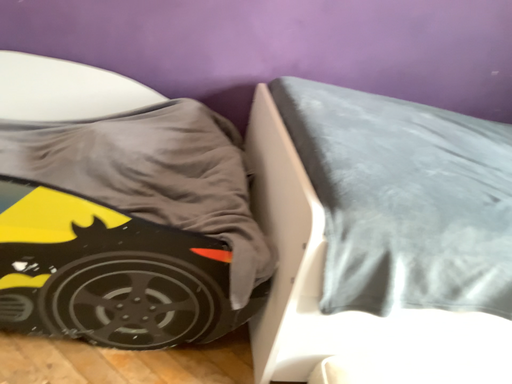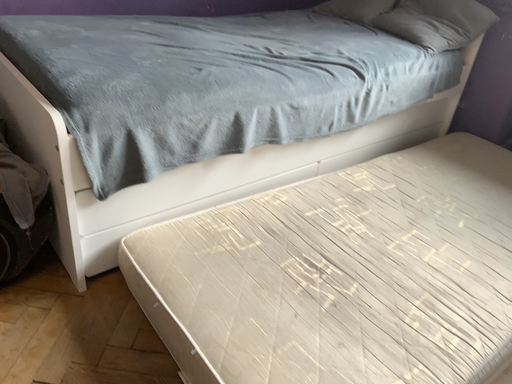
Question: How did the camera likely rotate when shooting the video?

Choices:
 (A) rotated right
 (B) rotated left

Answer: (A)